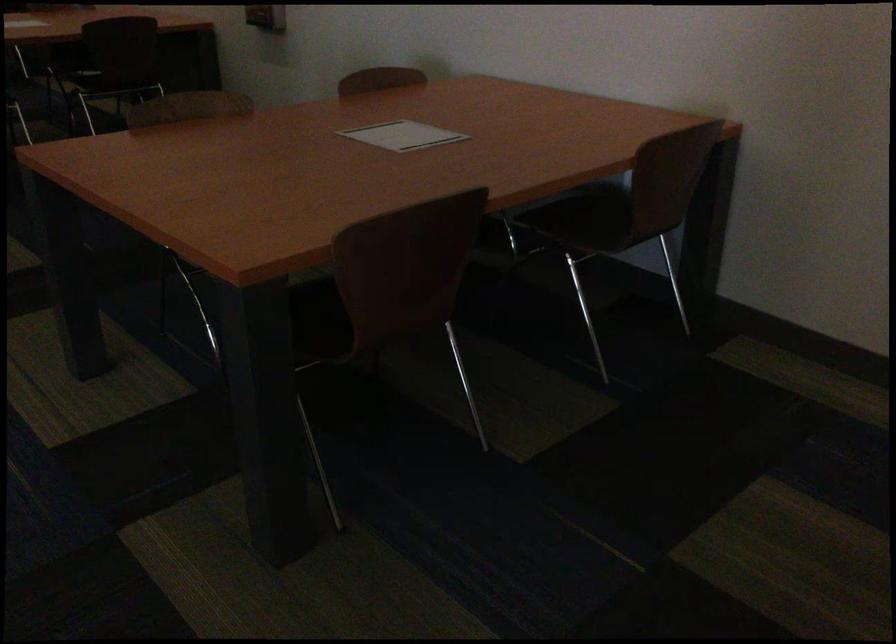
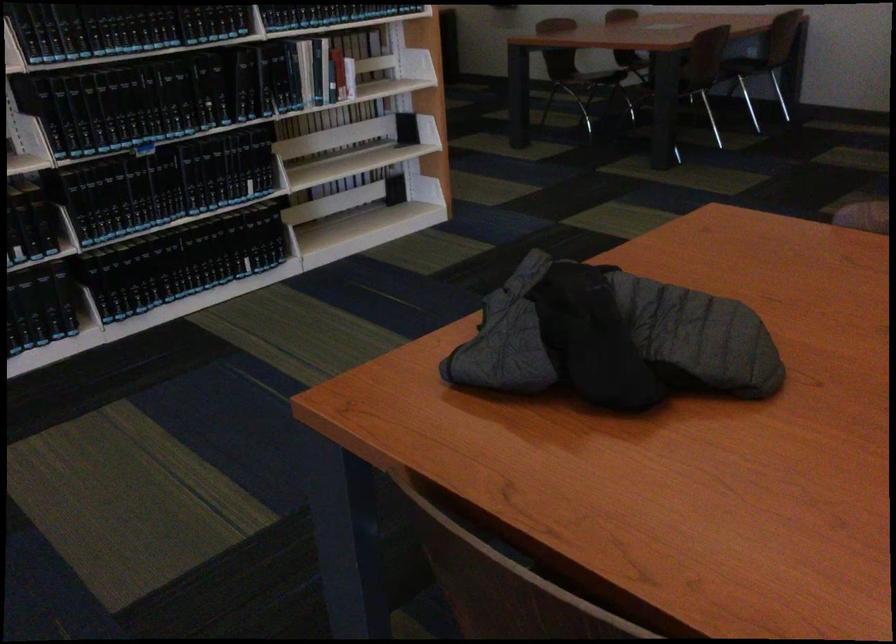
What movement of the cameraman would produce the second image?

The cameraman moved toward left, backward.